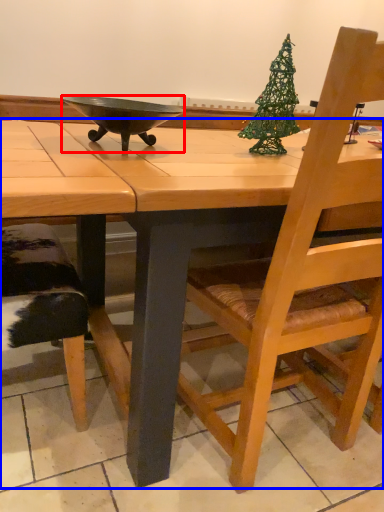
Question: Which point is closer to the camera, bowl (highlighted by a red box) or desk (highlighted by a blue box)?

Choices:
 (A) bowl
 (B) desk

Answer: (B)